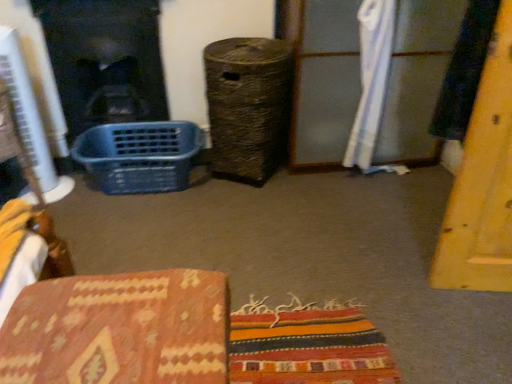
Image resolution: width=512 pixels, height=384 pixels. Describe the element at coordinates (371, 81) in the screenshot. I see `white fabric curtain at upper right` at that location.

What do you see at coordinates (139, 156) in the screenshot? The height and width of the screenshot is (384, 512). I see `blue plastic basket at left` at bounding box center [139, 156].

Where is `black glass fireplace at left`? Image resolution: width=512 pixels, height=384 pixels. black glass fireplace at left is located at coordinates (105, 60).

Is blue plastic basket at left with black glass fireplace at left?

There is a gap between blue plastic basket at left and black glass fireplace at left.

How different are the orientations of blue plastic basket at left and black glass fireplace at left in degrees?

The angle between the facing direction of blue plastic basket at left and the facing direction of black glass fireplace at left is 5.33 degrees.

Considering the sizes of objects blue plastic basket at left and black glass fireplace at left in the image provided, who is thinner, blue plastic basket at left or black glass fireplace at left?

Thinner between the two is black glass fireplace at left.

Relative to white fabric curtain at upper right, is black glass fireplace at left in front or behind?

black glass fireplace at left is behind white fabric curtain at upper right.

Between black glass fireplace at left and white fabric curtain at upper right, which one has more height?

Standing taller between the two is white fabric curtain at upper right.

The image size is (512, 384). I want to click on curtain on the right of black glass fireplace at left, so click(371, 81).

From the image's perspective, would you say black glass fireplace at left is positioned over white fabric curtain at upper right?

Yes, from the image's perspective, black glass fireplace at left is on top of white fabric curtain at upper right.

Is black glass fireplace at left thinner than blue plastic basket at left?

Indeed, black glass fireplace at left has a lesser width compared to blue plastic basket at left.

Is black glass fireplace at left to the left of blue plastic basket at left from the viewer's perspective?

Yes, black glass fireplace at left is to the left of blue plastic basket at left.

Looking at this image, can blue plastic basket at left be found inside black glass fireplace at left?

No, blue plastic basket at left is not inside black glass fireplace at left.

Considering the points (365, 162) and (113, 178), which point is in front, point (365, 162) or point (113, 178)?

The point (113, 178) is more forward.

From a real-world perspective, is white fabric curtain at upper right physically located above or below blue plastic basket at left?

In terms of real-world spatial position, white fabric curtain at upper right is above blue plastic basket at left.

This screenshot has width=512, height=384. Find the location of `basket below the white fabric curtain at upper right (from the image's perspective)`. basket below the white fabric curtain at upper right (from the image's perspective) is located at coordinates (139, 156).

Is blue plastic basket at left at the back of white fabric curtain at upper right?

white fabric curtain at upper right is not turned away from blue plastic basket at left.

Is black glass fireplace at left at the back of white fabric curtain at upper right?

white fabric curtain at upper right does not have its back to black glass fireplace at left.

From the image's perspective, is white fabric curtain at upper right beneath black glass fireplace at left?

Correct, white fabric curtain at upper right appears lower than black glass fireplace at left in the image.

Does white fabric curtain at upper right touch black glass fireplace at left?

white fabric curtain at upper right and black glass fireplace at left are clearly separated.

Is white fabric curtain at upper right positioned behind black glass fireplace at left?

No, the depth of white fabric curtain at upper right is less than that of black glass fireplace at left.

Are blue plastic basket at left and white fabric curtain at upper right located far from each other?

Yes, blue plastic basket at left and white fabric curtain at upper right are quite far apart.

From the image's perspective, does blue plastic basket at left appear higher than white fabric curtain at upper right?

Actually, blue plastic basket at left appears below white fabric curtain at upper right in the image.

Locate an element on the screen. This screenshot has height=384, width=512. curtain in front of the blue plastic basket at left is located at coordinates (371, 81).

Does blue plastic basket at left have a smaller size compared to white fabric curtain at upper right?

No.

Find the location of `basket on the right side of black glass fireplace at left`. basket on the right side of black glass fireplace at left is located at coordinates (139, 156).

Image resolution: width=512 pixels, height=384 pixels. Identify the location of fireplace behind the white fabric curtain at upper right. (105, 60).

Based on their spatial positions, is blue plastic basket at left or black glass fireplace at left closer to white fabric curtain at upper right?

The object closer to white fabric curtain at upper right is blue plastic basket at left.

Considering their positions, is blue plastic basket at left positioned closer to black glass fireplace at left than white fabric curtain at upper right?

blue plastic basket at left lies closer to black glass fireplace at left than the other object.

From the image, which object appears to be nearer to white fabric curtain at upper right, black glass fireplace at left or blue plastic basket at left?

Among the two, blue plastic basket at left is located nearer to white fabric curtain at upper right.

From the image, which object appears to be nearer to blue plastic basket at left, black glass fireplace at left or white fabric curtain at upper right?

Among the two, black glass fireplace at left is located nearer to blue plastic basket at left.

Based on their spatial positions, is white fabric curtain at upper right or black glass fireplace at left closer to blue plastic basket at left?

Based on the image, black glass fireplace at left appears to be nearer to blue plastic basket at left.

From the image, which object appears to be farther from black glass fireplace at left, white fabric curtain at upper right or blue plastic basket at left?

white fabric curtain at upper right is further to black glass fireplace at left.

Find the location of a particular element. The width and height of the screenshot is (512, 384). basket situated between black glass fireplace at left and white fabric curtain at upper right from left to right is located at coordinates (139, 156).